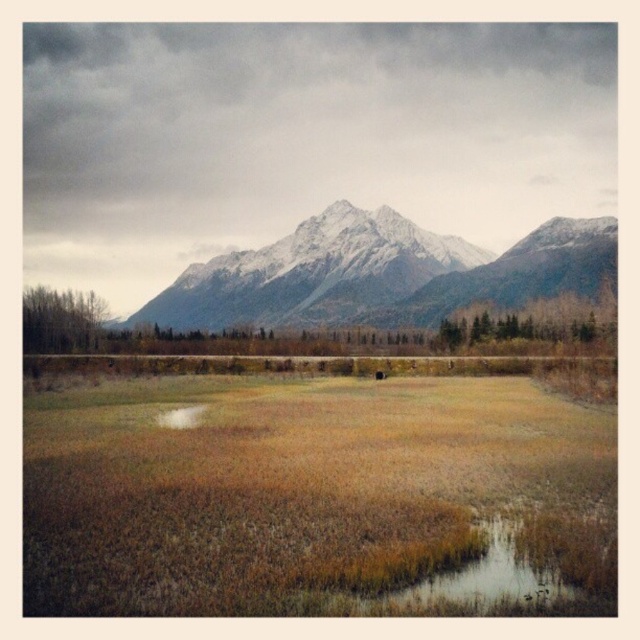
Question: Which point is closer to the camera taking this photo?

Choices:
 (A) (380, 275)
 (B) (401, 532)

Answer: (B)

Question: Among these objects, which one is farthest from the camera?

Choices:
 (A) snowy granite mountain range at upper center
 (B) brown dry grass at center

Answer: (A)

Question: Is brown dry grass at center wider than snowy granite mountain range at upper center?

Choices:
 (A) no
 (B) yes

Answer: (A)

Question: Does brown dry grass at center appear over snowy granite mountain range at upper center?

Choices:
 (A) no
 (B) yes

Answer: (A)

Question: Does brown dry grass at center appear on the left side of snowy granite mountain range at upper center?

Choices:
 (A) no
 (B) yes

Answer: (B)